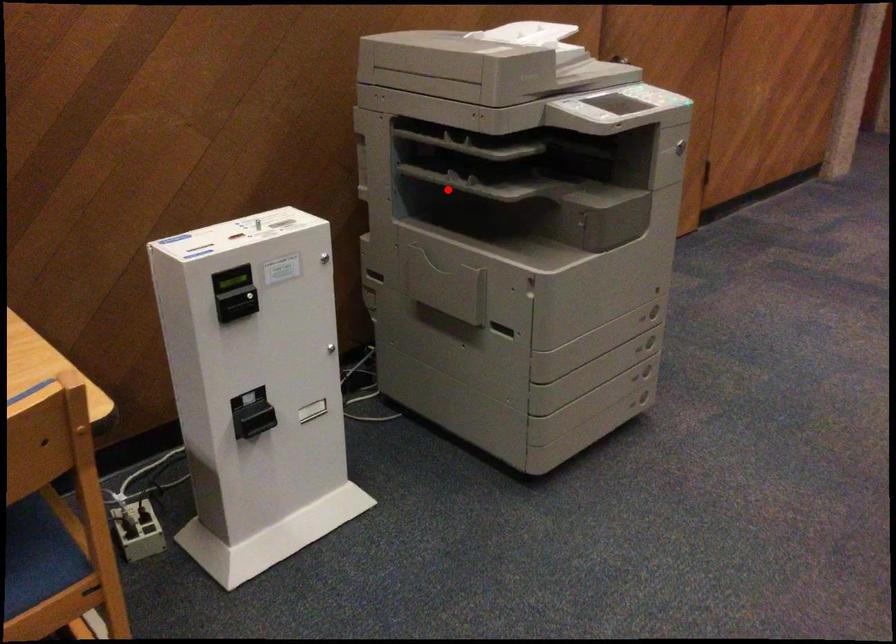
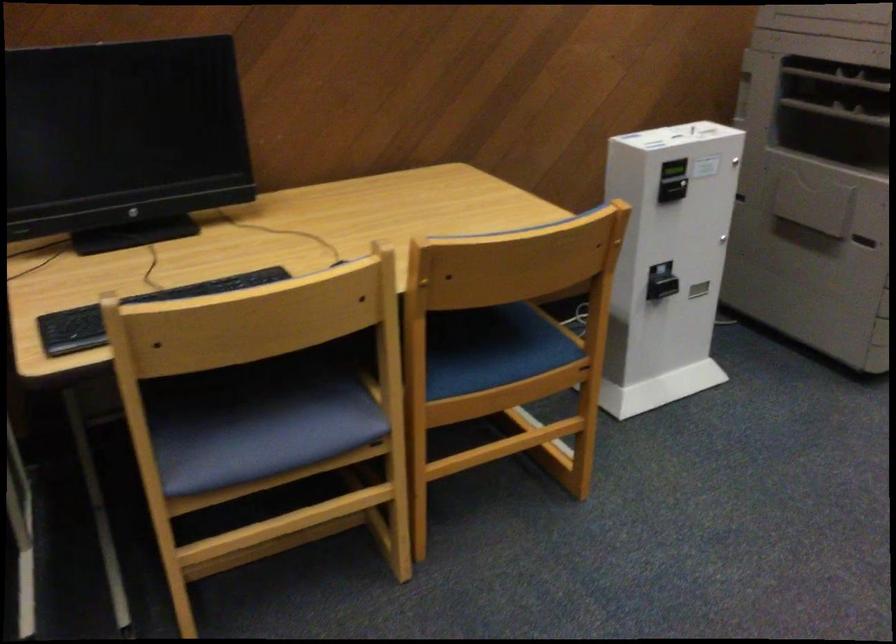
Question: I am providing you with two images of the same scene from different viewpoints. Given a red point in image1, look at the same physical point in image2. Is it:

Choices:
 (A) Closer to the viewpoint
 (B) Farther from the viewpoint

Answer: (B)